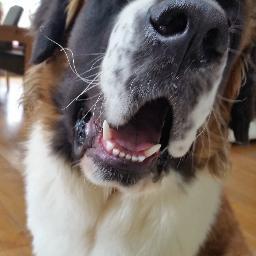
At what (x,y) coordinates should I click in order to perform the action: click on wood floor. Please return your answer as a coordinate pair (x, y). Image resolution: width=256 pixels, height=256 pixels. Looking at the image, I should click on (3, 174), (249, 168).